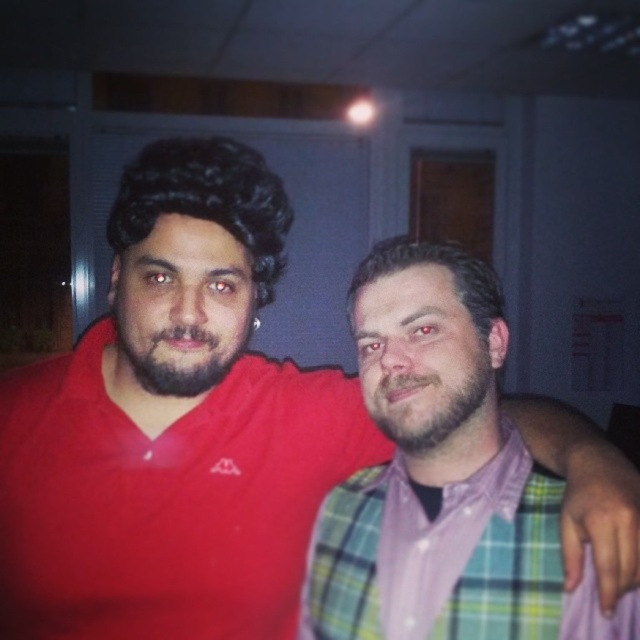
You are standing in the room where the two people are posing. You need to determine which of the two points, point (225,360) or point (412,451), is closer to you. Which one is closer?

Point (225,360) is closer to you because it is further to the viewer than point (412,451).

You are a photographer setting up a camera to capture the two people in the scene. You need to ensure that both the plaid fabric shirt at center and the brownwoollybeard at center are fully visible in the frame. Based on their positions, which object should you adjust the camera angle to prioritize capturing first?

The plaid fabric shirt at center might be wider than brownwoollybeard at center, so you should prioritize capturing the plaid fabric shirt at center first to ensure it fits within the frame.

You are a photographer adjusting lighting for a portrait. You need to ensure that both the plaid fabric shirt at center and the brownwoollybeard at center are evenly lit. Given their sizes, which object should you focus more light on?

The plaid fabric shirt at center has a larger size compared to brownwoollybeard at center, so you should focus more light on the plaid fabric shirt at center to ensure even illumination across both objects.